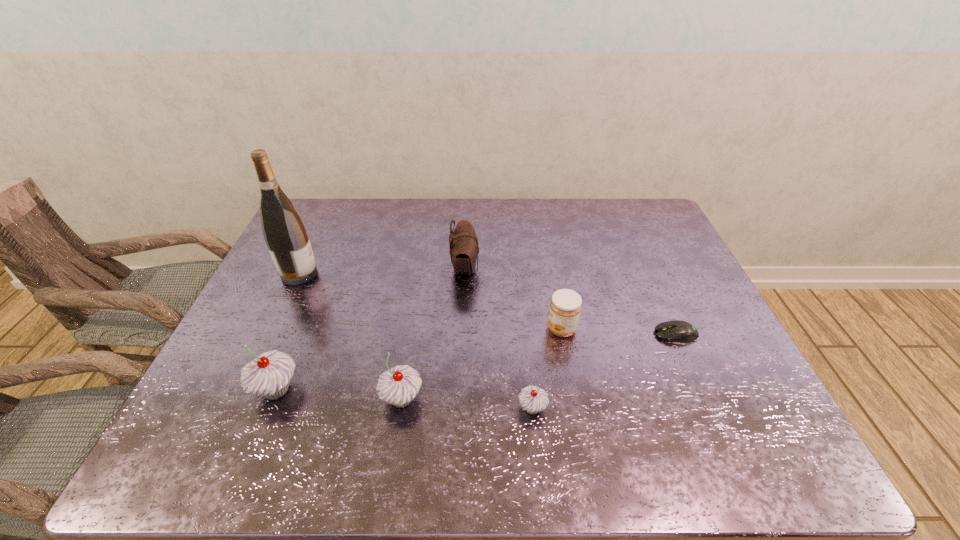
Identify the location of free point located 0.160m on the wheel side of the shortest object. (592, 334).

Find the location of a particular element. The height and width of the screenshot is (540, 960). cupcake that is at the left edge is located at coordinates (269, 375).

The image size is (960, 540). Find the location of `wine bottle that is positioned at the left edge`. wine bottle that is positioned at the left edge is located at coordinates (284, 231).

This screenshot has width=960, height=540. What are the coordinates of `object at the right edge` in the screenshot? It's located at (678, 331).

The height and width of the screenshot is (540, 960). Identify the location of object located at the near left corner. coord(269,375).

The width and height of the screenshot is (960, 540). Identify the location of free location at the far edge of the desktop. (407, 229).

Where is `free spot at the near edge of the desktop`? The image size is (960, 540). free spot at the near edge of the desktop is located at coordinates (564, 412).

In the image, there is a desktop. Where is `free space at the left edge`? This screenshot has height=540, width=960. free space at the left edge is located at coordinates (261, 303).

At what (x,y) coordinates should I click in order to perform the action: click on vacant region at the right edge of the desktop. Please return your answer as a coordinate pair (x, y). Image resolution: width=960 pixels, height=540 pixels. Looking at the image, I should click on (669, 299).

In the image, there is a desktop. Identify the location of vacant space at the far left corner. (332, 202).